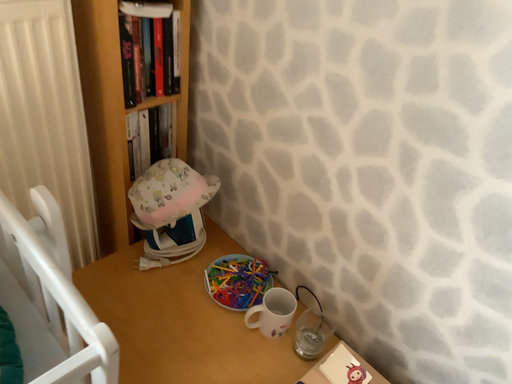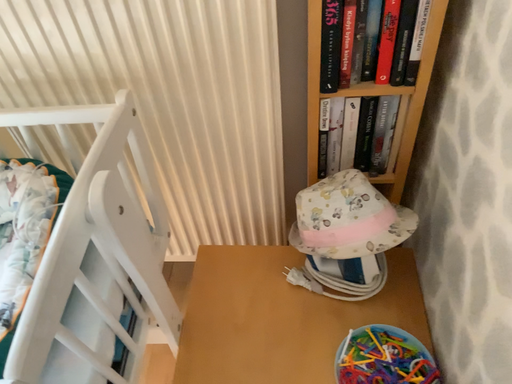
Question: How did the camera likely rotate when shooting the video?

Choices:
 (A) rotated right
 (B) rotated left

Answer: (B)